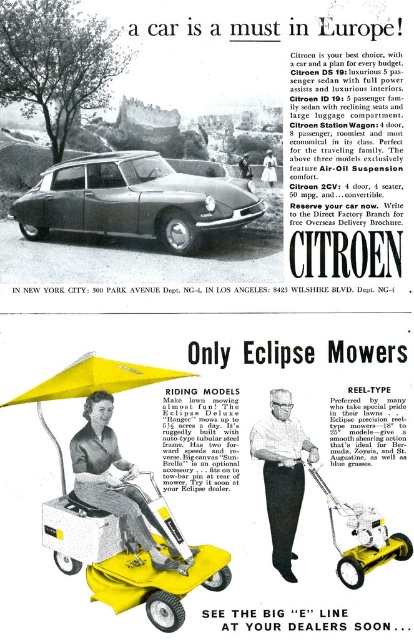
Question: Considering the relative positions of matte silver car at center and white fabric riding mower at center in the image provided, where is matte silver car at center located with respect to white fabric riding mower at center?

Choices:
 (A) below
 (B) above

Answer: (B)

Question: Which object is farther from the camera taking this photo?

Choices:
 (A) yellow fabric canopy at lower left
 (B) yellow plastic mower at lower right
 (C) matte silver car at center
 (D) white fabric riding mower at center

Answer: (C)

Question: In this image, where is white fabric riding mower at center located relative to yellow fabric canopy at lower left?

Choices:
 (A) below
 (B) above

Answer: (A)

Question: Does matte silver car at center have a smaller size compared to yellow plastic mower at lower right?

Choices:
 (A) no
 (B) yes

Answer: (A)

Question: Which point is closer to the camera?

Choices:
 (A) (101, 188)
 (B) (284, 506)
 (C) (108, 508)
 (D) (67, 387)

Answer: (C)

Question: Which is nearer to the white fabric riding mower at center?

Choices:
 (A) yellow fabric canopy at lower left
 (B) matte silver car at center
 (C) yellow fabric riding mower at lower left
 (D) yellow plastic mower at lower right

Answer: (D)